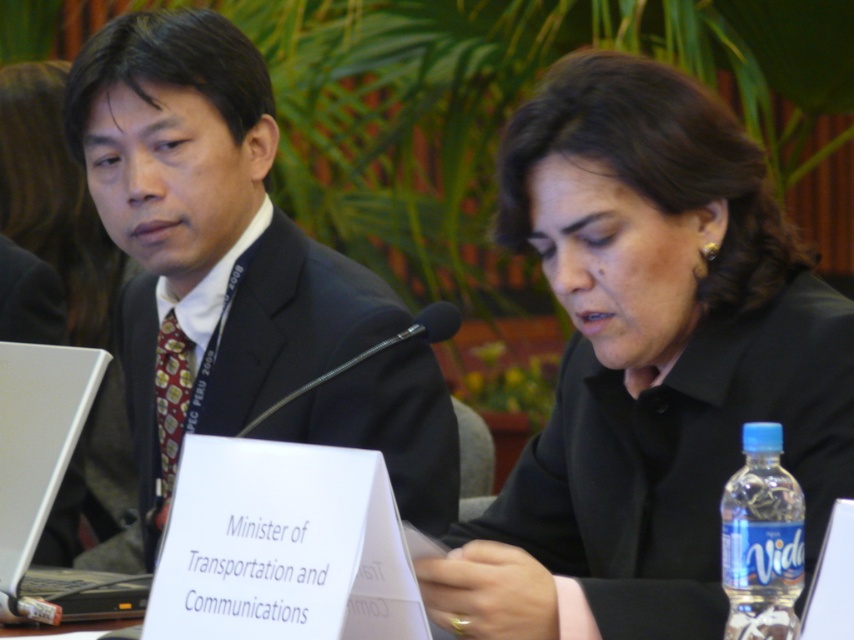
Identify the location of dark suit at center. This screenshot has height=640, width=854. (205, 237).

Is dark suit at center further to the viewer compared to silver metallic laptop at left?

Yes, it is behind silver metallic laptop at left.

Which is in front, point (192, 412) or point (69, 424)?

Positioned in front is point (69, 424).

Where is `dark suit at center`? This screenshot has width=854, height=640. dark suit at center is located at coordinates (205, 237).

Who is more distant from viewer, [13,552] or [774,612]?

Positioned behind is point [13,552].

Locate an element on the screen. Image resolution: width=854 pixels, height=640 pixels. silver metallic laptop at left is located at coordinates (47, 481).

Based on the photo, how far apart are black matte shirt at center and silver metallic laptop at left?

black matte shirt at center is 67.74 centimeters from silver metallic laptop at left.

Between black matte shirt at center and silver metallic laptop at left, which one appears on the right side from the viewer's perspective?

Positioned to the right is black matte shirt at center.

Describe the element at coordinates (647, 362) in the screenshot. I see `black matte shirt at center` at that location.

This screenshot has width=854, height=640. In order to click on black matte shirt at center in this screenshot , I will do `click(647, 362)`.